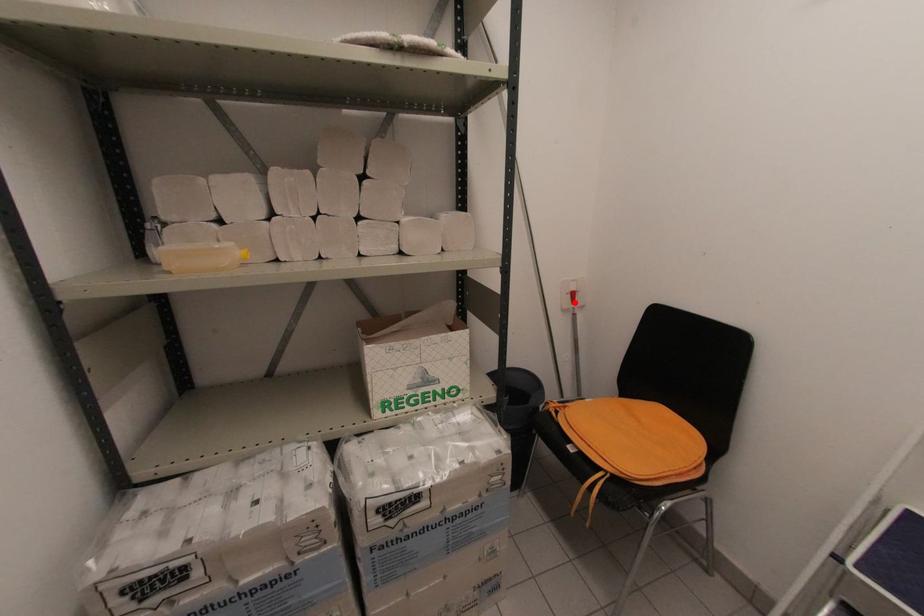
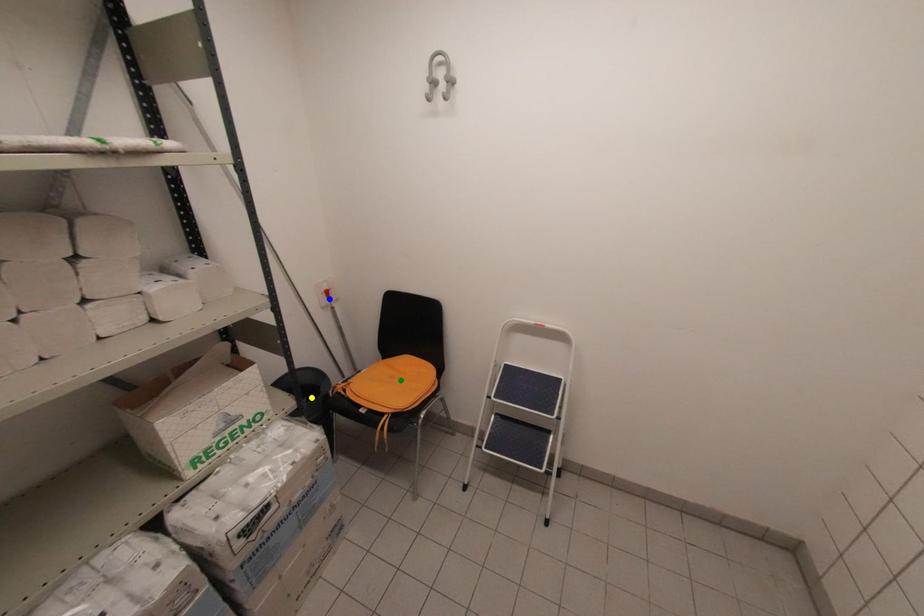
Question: I am providing you with two images of the same scene from different viewpoints. A red point is marked on the first image. You are given multiple points on the second image. Which mark in image 2 goes with the point in image 1?

Choices:
 (A) green point
 (B) yellow point
 (C) blue point

Answer: (C)